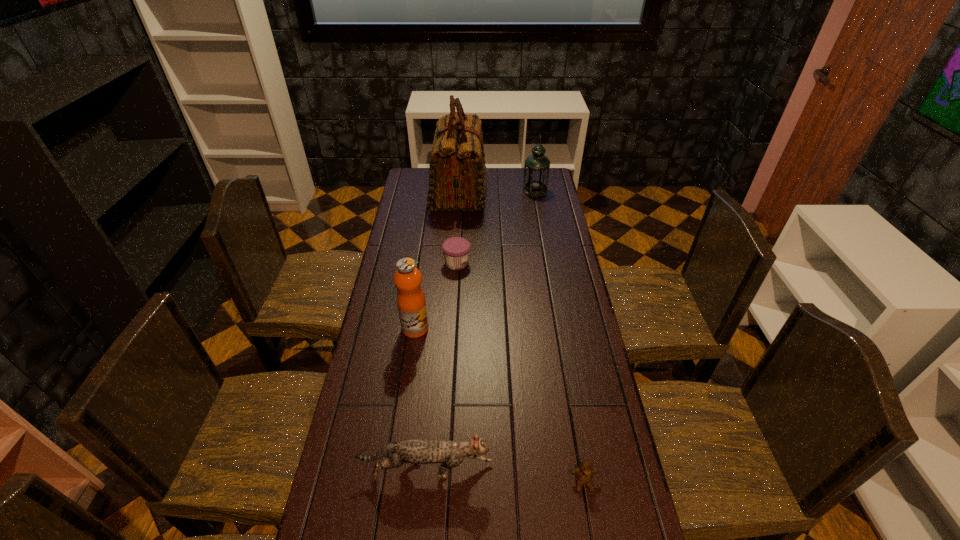
You are a GUI agent. You are given a task and a screenshot of the screen. Output one action in this format:
    pyautogui.click(x=<x>, y=<y>)
    Task: Click on the free area in between the cat and the jam
    
    Given the screenshot: What is the action you would take?
    pyautogui.click(x=442, y=367)

The image size is (960, 540). I want to click on vacant area that lies between the third shortest object and the shopping bag, so click(443, 331).

Where is `empty location between the third shortest object and the fruit juice`? empty location between the third shortest object and the fruit juice is located at coordinates (420, 399).

Where is `vacant region between the third shortest object and the third farthest object`? The image size is (960, 540). vacant region between the third shortest object and the third farthest object is located at coordinates (442, 367).

Identify which object is located as the second nearest to the fourth farthest object. Please provide its 2D coordinates. Your answer should be formatted as a tuple, i.e. [(x, y)], where the tuple contains the x and y coordinates of a point satisfying the conditions above.

[(450, 454)]

At what (x,y) coordinates should I click in order to perform the action: click on object that stands as the fourth closest to the fruit juice. Please return your answer as a coordinate pair (x, y). Looking at the image, I should click on (457, 181).

Locate an element on the screen. Image resolution: width=960 pixels, height=540 pixels. vacant space that satisfies the following two spatial constraints: 1. on the front side of the oil lamp; 2. on the open handle side of the tallest object is located at coordinates (535, 192).

Where is `vacant position in the image that satisfies the following two spatial constraints: 1. on the front side of the oil lamp; 2. on the open handle side of the shopping bag`? vacant position in the image that satisfies the following two spatial constraints: 1. on the front side of the oil lamp; 2. on the open handle side of the shopping bag is located at coordinates (535, 192).